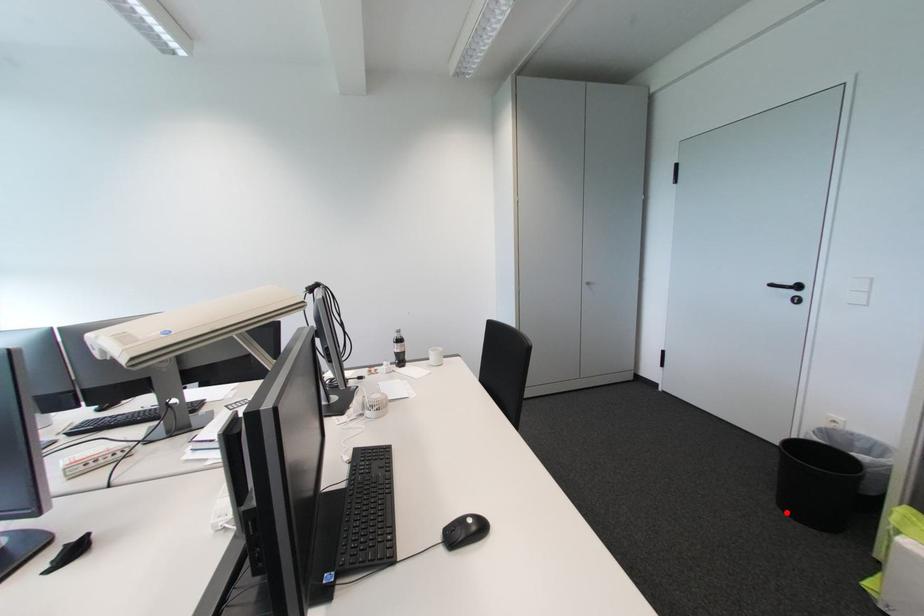
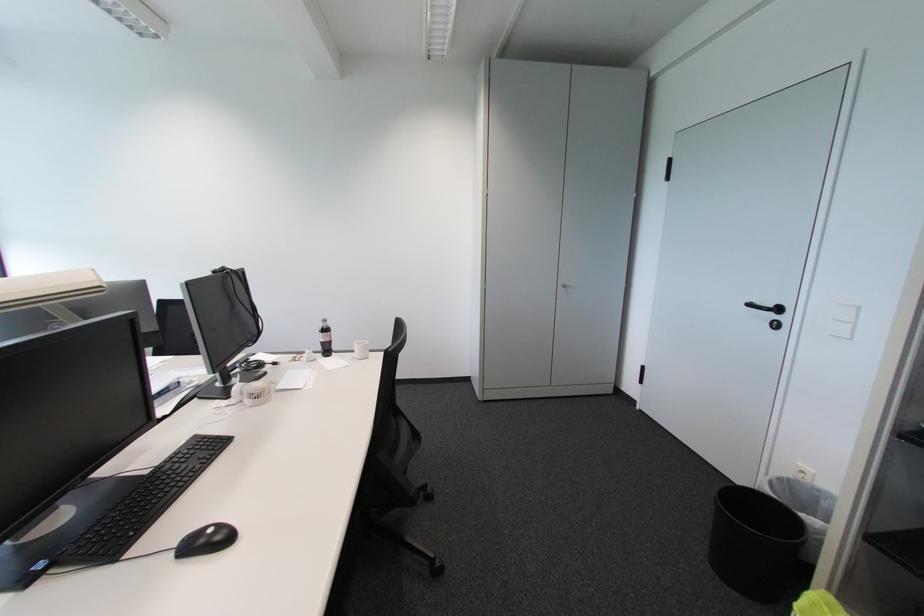
In the second image, find the point that corresponds to the highlighted location in the first image.

(714, 565)